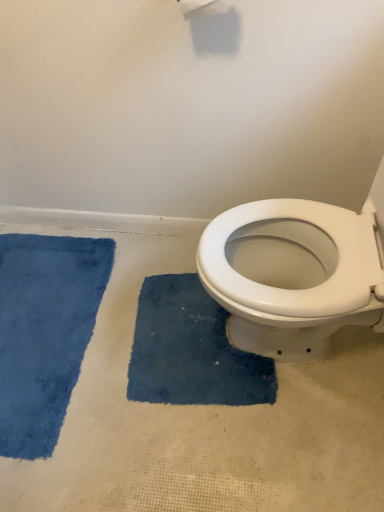
You are a GUI agent. You are given a task and a screenshot of the screen. Output one action in this format:
    pyautogui.click(x=<x>, y=<y>)
    Task: Click on the blue plush bath mat at left, which ranks as the first bath mat in left-to-right order
    Image resolution: width=384 pixels, height=512 pixels.
    Given the screenshot: What is the action you would take?
    pyautogui.click(x=45, y=332)

The width and height of the screenshot is (384, 512). What do you see at coordinates (45, 332) in the screenshot?
I see `blue plush bath mat at left, placed as the second bath mat when sorted from right to left` at bounding box center [45, 332].

Consider the image. Measure the distance between point [60,354] and camera.

The distance of point [60,354] from camera is 4.48 feet.

Identify the location of blue plush bath mat at center, the first bath mat positioned from the right. click(191, 350).

What do you see at coordinates (191, 350) in the screenshot?
I see `blue plush bath mat at center, the first bath mat positioned from the right` at bounding box center [191, 350].

Locate an element on the screen. This screenshot has height=512, width=384. blue plush bath mat at left, which ranks as the first bath mat in left-to-right order is located at coordinates (45, 332).

Is blue plush bath mat at left, which ranks as the first bath mat in left-to-right order, at the right side of blue plush bath mat at center, which appears as the 2th bath mat when viewed from the left?

No, blue plush bath mat at left, which ranks as the first bath mat in left-to-right order, is not to the right of blue plush bath mat at center, which appears as the 2th bath mat when viewed from the left.

In the scene shown: Considering their positions, is blue plush bath mat at left, which ranks as the first bath mat in left-to-right order, located in front of or behind blue plush bath mat at center, which appears as the 2th bath mat when viewed from the left?

blue plush bath mat at left, which ranks as the first bath mat in left-to-right order, is in front of blue plush bath mat at center, which appears as the 2th bath mat when viewed from the left.

Is point (22, 420) behind point (146, 317)?

No.

From the image's perspective, is blue plush bath mat at left, which ranks as the first bath mat in left-to-right order, located above or below blue plush bath mat at center, the first bath mat positioned from the right?

blue plush bath mat at left, which ranks as the first bath mat in left-to-right order, is above blue plush bath mat at center, the first bath mat positioned from the right.

From a real-world perspective, is blue plush bath mat at left, which ranks as the first bath mat in left-to-right order, physically located above or below blue plush bath mat at center, the first bath mat positioned from the right?

blue plush bath mat at left, which ranks as the first bath mat in left-to-right order, is above blue plush bath mat at center, the first bath mat positioned from the right.

Does blue plush bath mat at left, placed as the second bath mat when sorted from right to left, have a lesser width compared to blue plush bath mat at center, the first bath mat positioned from the right?

Incorrect, the width of blue plush bath mat at left, placed as the second bath mat when sorted from right to left, is not less than that of blue plush bath mat at center, the first bath mat positioned from the right.

Considering the sizes of blue plush bath mat at left, placed as the second bath mat when sorted from right to left, and blue plush bath mat at center, which appears as the 2th bath mat when viewed from the left, in the image, is blue plush bath mat at left, placed as the second bath mat when sorted from right to left, taller or shorter than blue plush bath mat at center, which appears as the 2th bath mat when viewed from the left,?

Considering their sizes, blue plush bath mat at left, placed as the second bath mat when sorted from right to left, has more height than blue plush bath mat at center, which appears as the 2th bath mat when viewed from the left.

Between blue plush bath mat at left, which ranks as the first bath mat in left-to-right order, and blue plush bath mat at center, which appears as the 2th bath mat when viewed from the left, which one has larger size?

blue plush bath mat at left, which ranks as the first bath mat in left-to-right order, is bigger.

Would you say blue plush bath mat at left, placed as the second bath mat when sorted from right to left, contains blue plush bath mat at center, the first bath mat positioned from the right?

No, blue plush bath mat at center, the first bath mat positioned from the right, is not a part of blue plush bath mat at left, placed as the second bath mat when sorted from right to left.

Can you see blue plush bath mat at left, placed as the second bath mat when sorted from right to left, touching blue plush bath mat at center, which appears as the 2th bath mat when viewed from the left?

No, blue plush bath mat at left, placed as the second bath mat when sorted from right to left, is not in contact with blue plush bath mat at center, which appears as the 2th bath mat when viewed from the left.

Consider the image. Is blue plush bath mat at left, placed as the second bath mat when sorted from right to left, oriented towards blue plush bath mat at center, which appears as the 2th bath mat when viewed from the left?

No, blue plush bath mat at left, placed as the second bath mat when sorted from right to left, is not oriented towards blue plush bath mat at center, which appears as the 2th bath mat when viewed from the left.

Can you tell me how much blue plush bath mat at left, placed as the second bath mat when sorted from right to left, and blue plush bath mat at center, which appears as the 2th bath mat when viewed from the left, differ in facing direction?

blue plush bath mat at left, placed as the second bath mat when sorted from right to left, and blue plush bath mat at center, which appears as the 2th bath mat when viewed from the left, are facing 7.64 degrees away from each other.

The width and height of the screenshot is (384, 512). Identify the location of bath mat to the right of blue plush bath mat at left, placed as the second bath mat when sorted from right to left. (191, 350).

Is blue plush bath mat at center, the first bath mat positioned from the right, to the left of blue plush bath mat at left, which ranks as the first bath mat in left-to-right order, from the viewer's perspective?

No.

Which object is closer to the camera taking this photo, blue plush bath mat at center, the first bath mat positioned from the right, or blue plush bath mat at left, placed as the second bath mat when sorted from right to left?

blue plush bath mat at left, placed as the second bath mat when sorted from right to left, is in front.

Does point (171, 340) come closer to viewer compared to point (49, 377)?

No.

From the image's perspective, which is above, blue plush bath mat at center, the first bath mat positioned from the right, or blue plush bath mat at left, which ranks as the first bath mat in left-to-right order?

blue plush bath mat at left, which ranks as the first bath mat in left-to-right order, from the image's perspective.

From a real-world perspective, which object stands above the other?

blue plush bath mat at left, placed as the second bath mat when sorted from right to left.

In the scene shown: Between blue plush bath mat at center, the first bath mat positioned from the right, and blue plush bath mat at left, placed as the second bath mat when sorted from right to left, which one has larger width?

Wider between the two is blue plush bath mat at left, placed as the second bath mat when sorted from right to left.

Can you confirm if blue plush bath mat at center, the first bath mat positioned from the right, is shorter than blue plush bath mat at left, which ranks as the first bath mat in left-to-right order?

Correct, blue plush bath mat at center, the first bath mat positioned from the right, is not as tall as blue plush bath mat at left, which ranks as the first bath mat in left-to-right order.

Does blue plush bath mat at center, which appears as the 2th bath mat when viewed from the left, have a larger size compared to blue plush bath mat at left, which ranks as the first bath mat in left-to-right order?

Incorrect, blue plush bath mat at center, which appears as the 2th bath mat when viewed from the left, is not larger than blue plush bath mat at left, which ranks as the first bath mat in left-to-right order.

Is blue plush bath mat at center, which appears as the 2th bath mat when viewed from the left, spatially inside blue plush bath mat at left, placed as the second bath mat when sorted from right to left, or outside of it?

blue plush bath mat at center, which appears as the 2th bath mat when viewed from the left, lies outside blue plush bath mat at left, placed as the second bath mat when sorted from right to left.

Is blue plush bath mat at center, which appears as the 2th bath mat when viewed from the left, in contact with blue plush bath mat at left, which ranks as the first bath mat in left-to-right order?

blue plush bath mat at center, which appears as the 2th bath mat when viewed from the left, and blue plush bath mat at left, which ranks as the first bath mat in left-to-right order, are not in contact.

Looking at this image, is blue plush bath mat at center, the first bath mat positioned from the right, turned away from blue plush bath mat at left, which ranks as the first bath mat in left-to-right order?

No.

What's the angular difference between blue plush bath mat at center, the first bath mat positioned from the right, and blue plush bath mat at left, placed as the second bath mat when sorted from right to left,'s facing directions?

They differ by 7.64 degrees in their facing directions.

In the scene shown: How far apart are blue plush bath mat at center, the first bath mat positioned from the right, and blue plush bath mat at left, placed as the second bath mat when sorted from right to left?

A: The distance of blue plush bath mat at center, the first bath mat positioned from the right, from blue plush bath mat at left, placed as the second bath mat when sorted from right to left, is 12.71 inches.

Identify the location of bath mat behind the blue plush bath mat at left, placed as the second bath mat when sorted from right to left. (191, 350).

This screenshot has height=512, width=384. In order to click on bath mat on the left of blue plush bath mat at center, which appears as the 2th bath mat when viewed from the left in this screenshot , I will do `click(45, 332)`.

This screenshot has width=384, height=512. What are the coordinates of `bath mat that appears in front of the blue plush bath mat at center, which appears as the 2th bath mat when viewed from the left` in the screenshot? It's located at (45, 332).